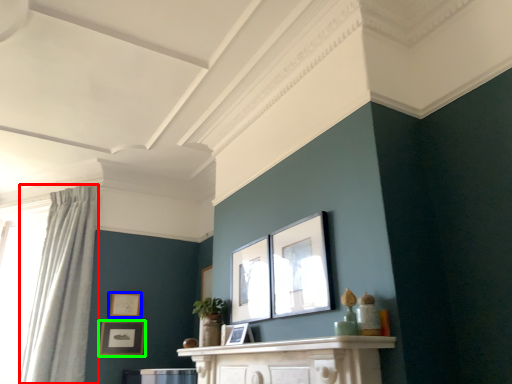
Question: Estimate the real-world distances between objects in this image. Which object is closer to curtain (highlighted by a red box), picture frame (highlighted by a blue box) or picture frame (highlighted by a green box)?

Choices:
 (A) picture frame
 (B) picture frame

Answer: (B)